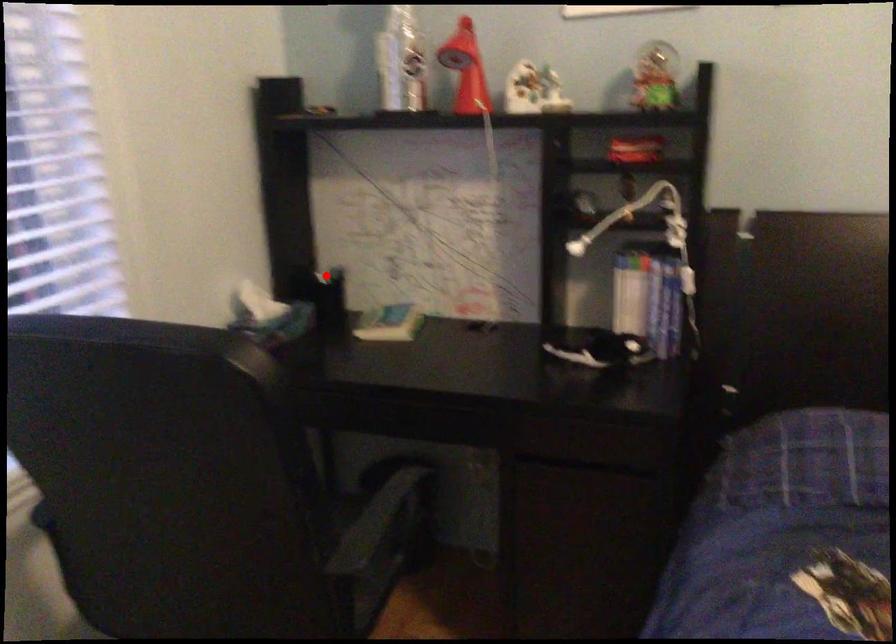
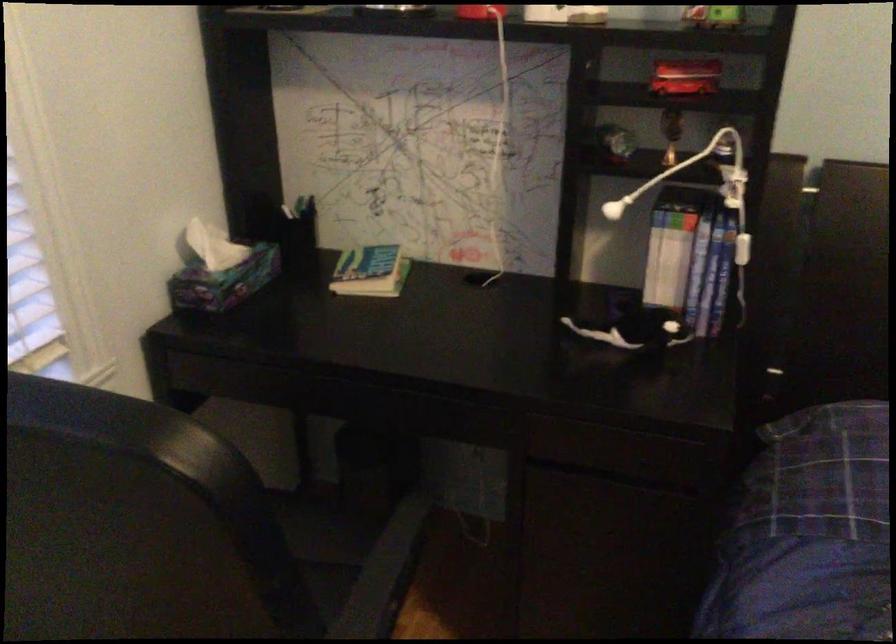
Locate, in the second image, the point that corresponds to the highlighted location in the first image.

(295, 211)